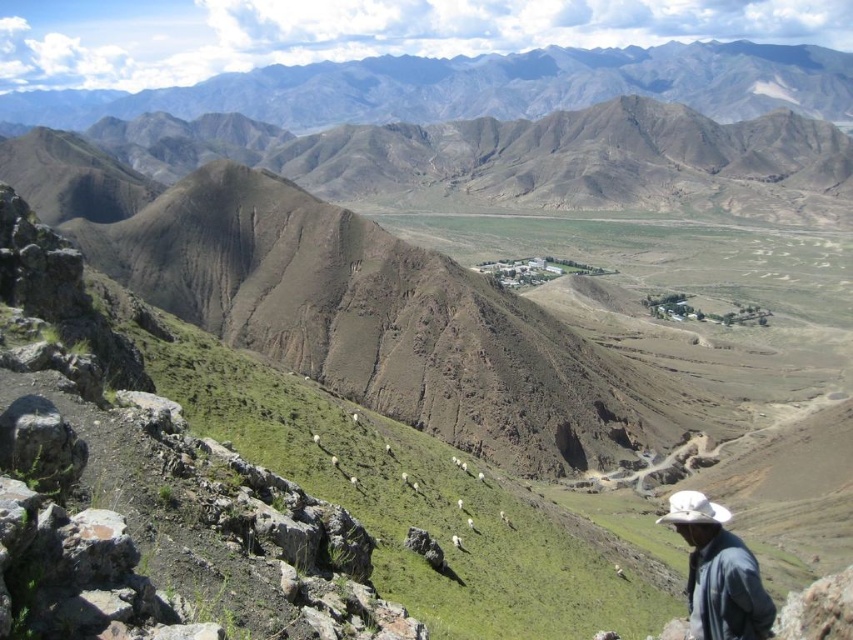
You are a hiker standing at the base of the gray rocky mountains at upper center and looking towards the dark blue denim jacket at lower right. Which object appears taller from your perspective?

The gray rocky mountains at upper center appears taller than the dark blue denim jacket at lower right because the gray rocky mountains at upper center has a greater height compared to dark blue denim jacket at lower right.

From the picture: You are an outdoor photographer who wants to capture the gray rocky mountains at upper center and the dark blue denim jacket at lower right in the same frame. Which object should you focus on first to ensure both are in the frame?

The gray rocky mountains at upper center is larger in size than the dark blue denim jacket at lower right, so you should focus on the gray rocky mountains at upper center first to ensure both fit into the frame.

You are a hiker standing at the base of the gray rocky mountains at upper center. You want to reach the summit. Given that the average hiking speed is 3 km per hour, how long would it take to reach the summit?

The gray rocky mountains at upper center is 633.91 meters away from camera. At an average hiking speed of 3 km per hour, it would take approximately 13 minutes to reach the summit.